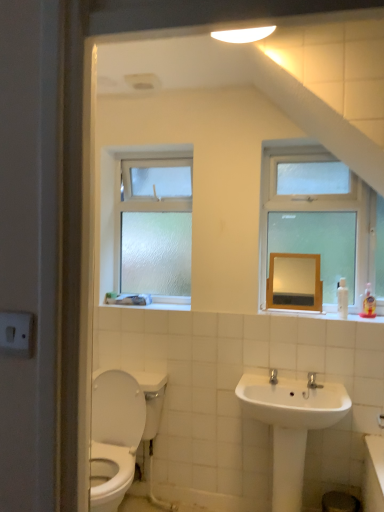
Question: Should I look upward or downward to see frosted glass window at upper left, which appears as the first window when viewed from the back?

Choices:
 (A) down
 (B) up

Answer: (B)

Question: Can you confirm if clear glass window at upper right, which appears as the 1th window when viewed from the front, is positioned to the left of frosted glass window at upper left, positioned as the 2th window in front-to-back order?

Choices:
 (A) yes
 (B) no

Answer: (B)

Question: Does clear glass window at upper right, which is counted as the second window, starting from the back, have a greater height compared to frosted glass window at upper left, positioned as the 2th window in front-to-back order?

Choices:
 (A) no
 (B) yes

Answer: (B)

Question: Is the depth of clear glass window at upper right, which is counted as the second window, starting from the back, greater than that of frosted glass window at upper left, positioned as the 2th window in front-to-back order?

Choices:
 (A) no
 (B) yes

Answer: (A)

Question: Considering the relative sizes of clear glass window at upper right, the 2th window in the left-to-right sequence, and frosted glass window at upper left, the 1th window positioned from the left, in the image provided, is clear glass window at upper right, the 2th window in the left-to-right sequence, wider than frosted glass window at upper left, the 1th window positioned from the left,?

Choices:
 (A) yes
 (B) no

Answer: (A)

Question: From a real-world perspective, is clear glass window at upper right, which appears as the 1th window when viewed from the front, located higher than frosted glass window at upper left, positioned as the 2th window in front-to-back order?

Choices:
 (A) no
 (B) yes

Answer: (B)

Question: Is clear glass window at upper right, placed as the 1th window when sorted from right to left, aimed at frosted glass window at upper left, marked as the 2th window in a right-to-left arrangement?

Choices:
 (A) yes
 (B) no

Answer: (B)

Question: Can you confirm if white glossy sink at lower center is taller than matte wooden mirror at upper center?

Choices:
 (A) yes
 (B) no

Answer: (A)

Question: Is matte wooden mirror at upper center at the back of white glossy sink at lower center?

Choices:
 (A) yes
 (B) no

Answer: (B)

Question: Is matte wooden mirror at upper center surrounded by white glossy sink at lower center?

Choices:
 (A) no
 (B) yes

Answer: (A)

Question: Considering the relative positions of white glossy sink at lower center and matte wooden mirror at upper center in the image provided, is white glossy sink at lower center to the left of matte wooden mirror at upper center from the viewer's perspective?

Choices:
 (A) yes
 (B) no

Answer: (A)

Question: Could you tell me if white glossy sink at lower center is facing matte wooden mirror at upper center?

Choices:
 (A) yes
 (B) no

Answer: (B)

Question: From the image's perspective, would you say white glossy sink at lower center is positioned over matte wooden mirror at upper center?

Choices:
 (A) yes
 (B) no

Answer: (B)

Question: Considering the relative sizes of white glossy sink at lower center and frosted glass window at upper left, the 1th window positioned from the left, in the image provided, is white glossy sink at lower center taller than frosted glass window at upper left, the 1th window positioned from the left,?

Choices:
 (A) no
 (B) yes

Answer: (A)